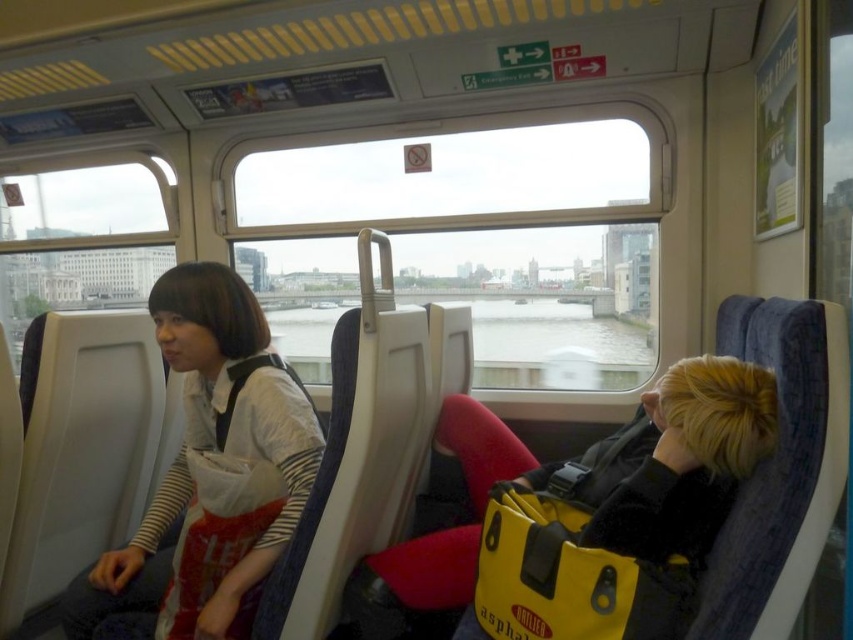
You are a passenger in the train carriage and want to place your yellow waterproof bag at center. Where should you place it so that it is exactly at the point with coordinates (621, 515)?

The yellow waterproof bag at center should be placed so that the point with coordinates (621, 515) is on it.

You are a luggage inspector on the train and need to check the yellow waterproof bag at center and the white matte shirt at left. Which item is wider?

The yellow waterproof bag at center might be wider than the white matte shirt at left.